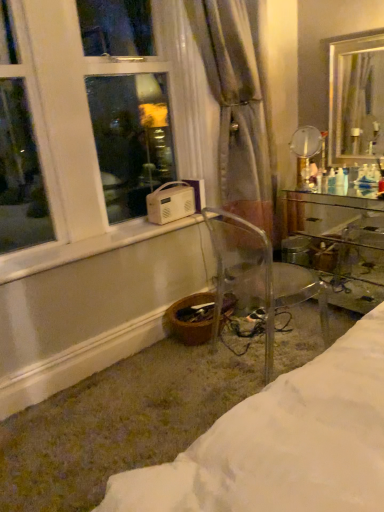
Question: Would you say transparent plastic chair at lower center is to the left or to the right of translucent fabric curtain at center in the picture?

Choices:
 (A) left
 (B) right

Answer: (B)

Question: Is transparent plastic chair at lower center inside or outside of translucent fabric curtain at center?

Choices:
 (A) outside
 (B) inside

Answer: (A)

Question: Which of these objects is positioned closest to the transparent plastic chair at lower center?

Choices:
 (A) clear glass mirror at upper right, marked as the 2th mirror in a right-to-left arrangement
 (B) translucent fabric curtain at center
 (C) clear glass desk at right
 (D) metallic gold mirror at upper right, arranged as the 1th mirror when viewed from the right
 (E) white plastic window at lower left

Answer: (B)

Question: Estimate the real-world distances between objects in this image. Which object is farther from the metallic gold mirror at upper right, arranged as the 1th mirror when viewed from the right?

Choices:
 (A) white plastic window at lower left
 (B) transparent plastic chair at lower center
 (C) clear glass desk at right
 (D) clear glass mirror at upper right, acting as the 1th mirror starting from the left
 (E) translucent fabric curtain at center

Answer: (A)